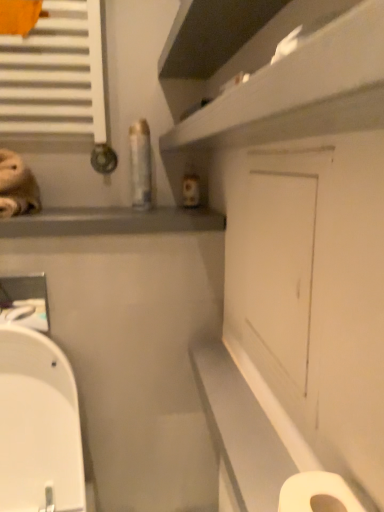
Question: Is the position of white glossy shelf at upper center more distant than that of white glossy toilet at lower left?

Choices:
 (A) yes
 (B) no

Answer: (B)

Question: Is white glossy shelf at upper center at the left side of white glossy toilet at lower left?

Choices:
 (A) yes
 (B) no

Answer: (B)

Question: From the image's perspective, does white glossy shelf at upper center appear lower than white glossy toilet at lower left?

Choices:
 (A) no
 (B) yes

Answer: (A)

Question: Is white glossy shelf at upper center shorter than white glossy toilet at lower left?

Choices:
 (A) no
 (B) yes

Answer: (B)

Question: Is white glossy shelf at upper center closer to the viewer compared to white glossy toilet at lower left?

Choices:
 (A) no
 (B) yes

Answer: (B)

Question: From the image's perspective, would you say white glossy shelf at upper center is positioned over white glossy toilet at lower left?

Choices:
 (A) yes
 (B) no

Answer: (A)

Question: Could you tell me if white matte toilet paper at lower right is turned towards white glossy toilet at lower left?

Choices:
 (A) yes
 (B) no

Answer: (B)

Question: Does white matte toilet paper at lower right appear on the right side of white glossy toilet at lower left?

Choices:
 (A) yes
 (B) no

Answer: (A)

Question: From the image's perspective, is white matte toilet paper at lower right below white glossy toilet at lower left?

Choices:
 (A) yes
 (B) no

Answer: (B)

Question: Is white matte toilet paper at lower right looking in the opposite direction of white glossy toilet at lower left?

Choices:
 (A) no
 (B) yes

Answer: (A)

Question: Is white glossy toilet at lower left completely or partially inside white matte toilet paper at lower right?

Choices:
 (A) no
 (B) yes

Answer: (A)

Question: Is white matte toilet paper at lower right far away from white glossy toilet at lower left?

Choices:
 (A) yes
 (B) no

Answer: (B)

Question: Is white glossy shelf at upper center looking in the opposite direction of white matte door at center?

Choices:
 (A) yes
 (B) no

Answer: (B)